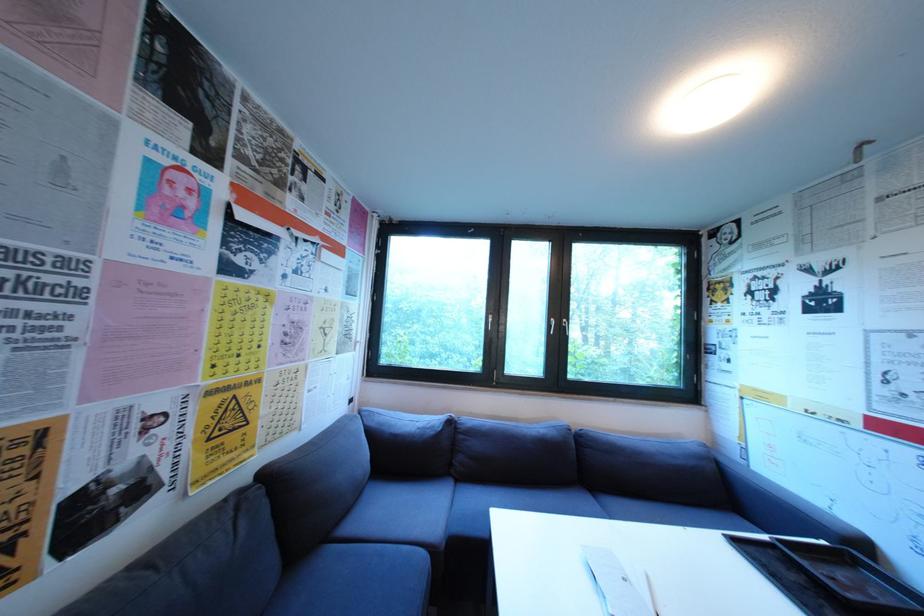
Where would you lift the black plastic tray? Please return your answer as a coordinate pair (x, y).

(828, 578)